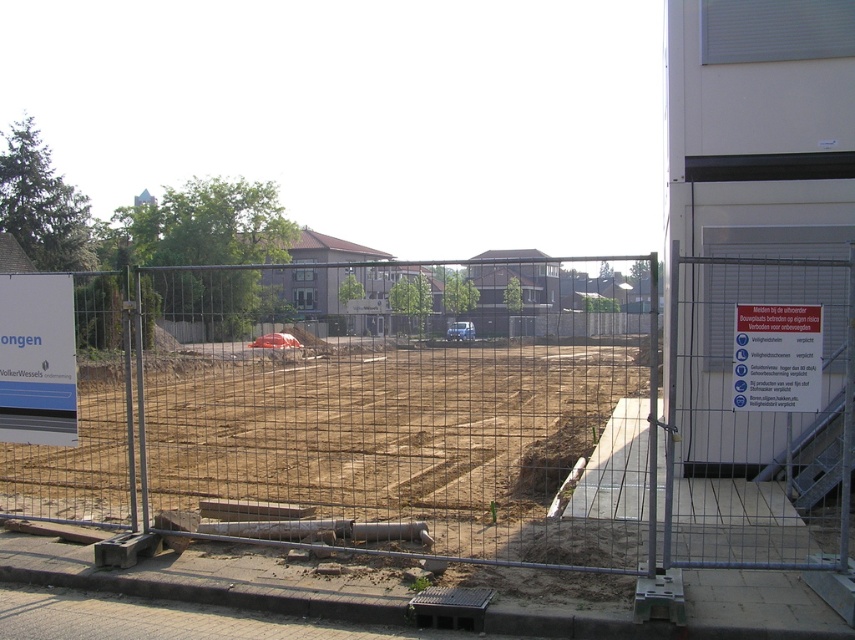
In the scene shown: Can you confirm if brown dirt at center is smaller than blue plastic sign at upper center?

Incorrect, brown dirt at center is not smaller in size than blue plastic sign at upper center.

Is point (581, 401) in front of point (10, 342)?

No, (581, 401) is further to viewer.

Locate an element on the screen. brown dirt at center is located at coordinates (416, 445).

Which is behind, point (25, 324) or point (775, 378)?

The point (25, 324) is behind.

Can you confirm if white paper sign at left is positioned below white paper sign at right?

Correct, white paper sign at left is located below white paper sign at right.

Identify the location of white paper sign at left. (37, 360).

Image resolution: width=855 pixels, height=640 pixels. What are the coordinates of `white paper sign at left` in the screenshot? It's located at (37, 360).

Who is more distant from viewer, [19,426] or [40,339]?

The point [19,426] is behind.

Between white paper sign at left and blue plastic sign at upper center, which one is positioned higher?

blue plastic sign at upper center is above.

Measure the distance between point (72, 349) and camera.

A distance of 20.71 feet exists between point (72, 349) and camera.

Find the location of a particular element. white paper sign at left is located at coordinates (37, 360).